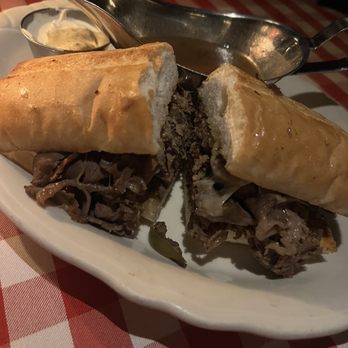
Where is `tablecloth`? tablecloth is located at coordinates (55, 319), (325, 84), (283, 16).